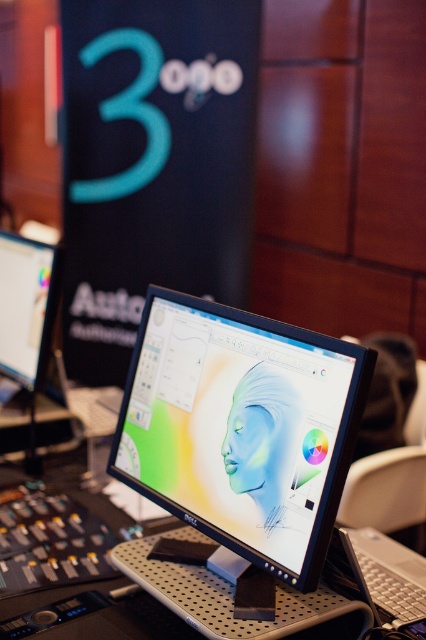
Who is positioned more to the right, satin black monitor at center or matte black monitor at left?

Positioned to the right is satin black monitor at center.

Is satin black monitor at center positioned before matte black monitor at left?

Yes, satin black monitor at center is in front of matte black monitor at left.

I want to click on satin black monitor at center, so click(241, 428).